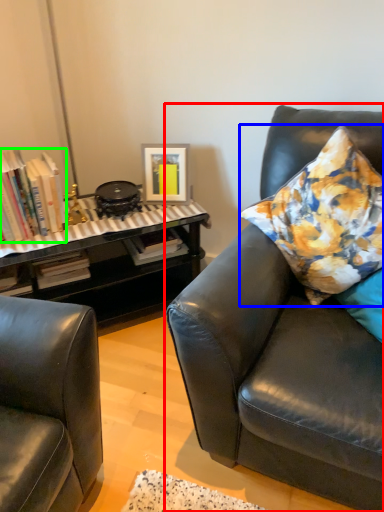
Question: Based on their relative distances, which object is nearer to studio couch (highlighted by a red box)? Choose from pillow (highlighted by a blue box) and book (highlighted by a green box).

Choices:
 (A) pillow
 (B) book

Answer: (A)